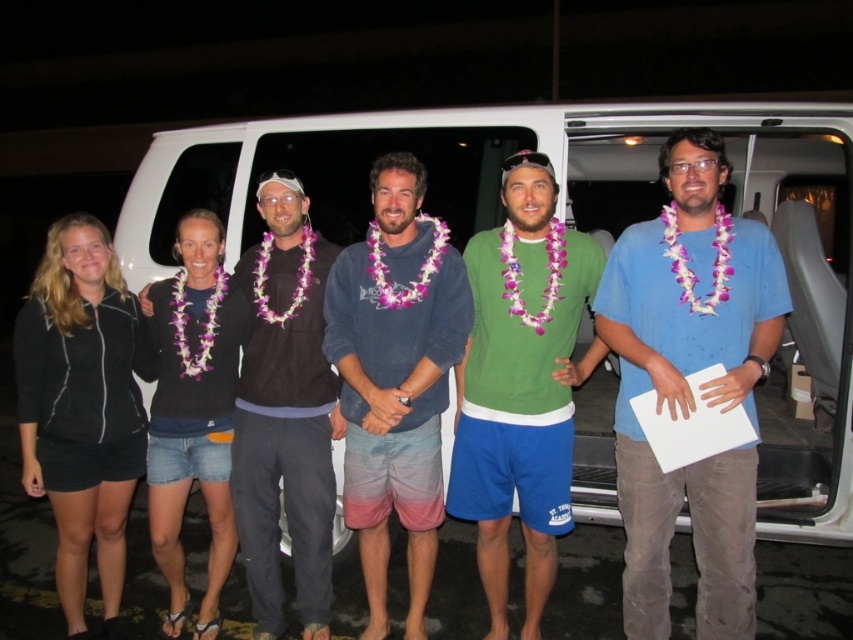
You are organizing a photo shoot and need to ensure that the blue cotton shirt at center and the black sweater at center are visible in the final image. Given their sizes, which one might require more space in the frame to avoid being cropped?

The blue cotton shirt at center has a greater width than the black sweater at center, so it would require more space in the frame to prevent cropping.

Looking at this image, looking at the group of six people in front of the van, can you determine which of the two people at the center are positioned to the right of the other? Specifically, is the green matte shirt at center located to the right of the black sweater at center?

Yes, the green matte shirt at center is positioned to the right of the black sweater at center.

You are a photographer trying to adjust the lighting for a group photo. The green matte shirt at center and the black sweater at center are both in the frame. Which of these two items has a greater width in the image?

The green matte shirt at center has a greater width than the black sweater at center according to the description.